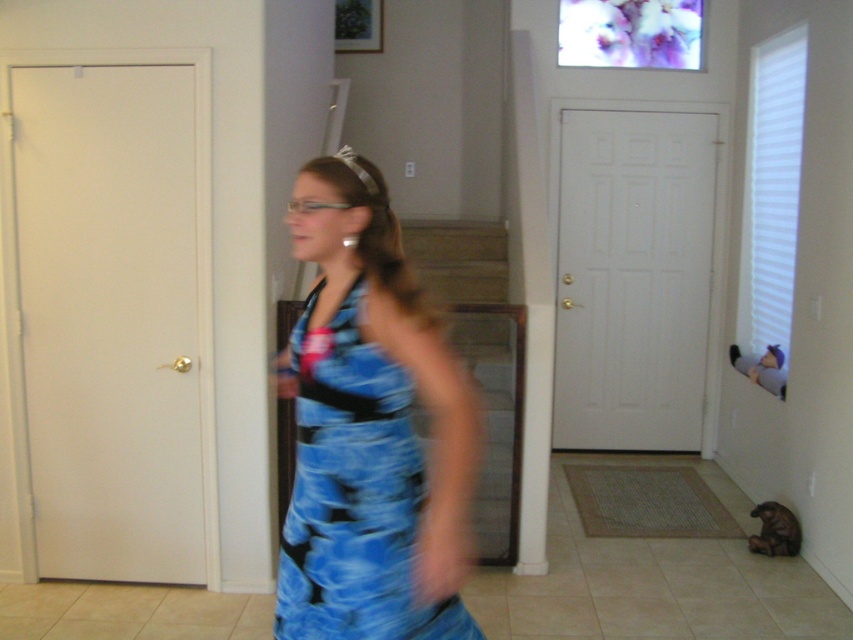
Based on the photo, based on the coordinates provided, where is the blue printed fabric dress at center located in the image?

The blue printed fabric dress at center is located at the coordinates point (354, 493) in the image.